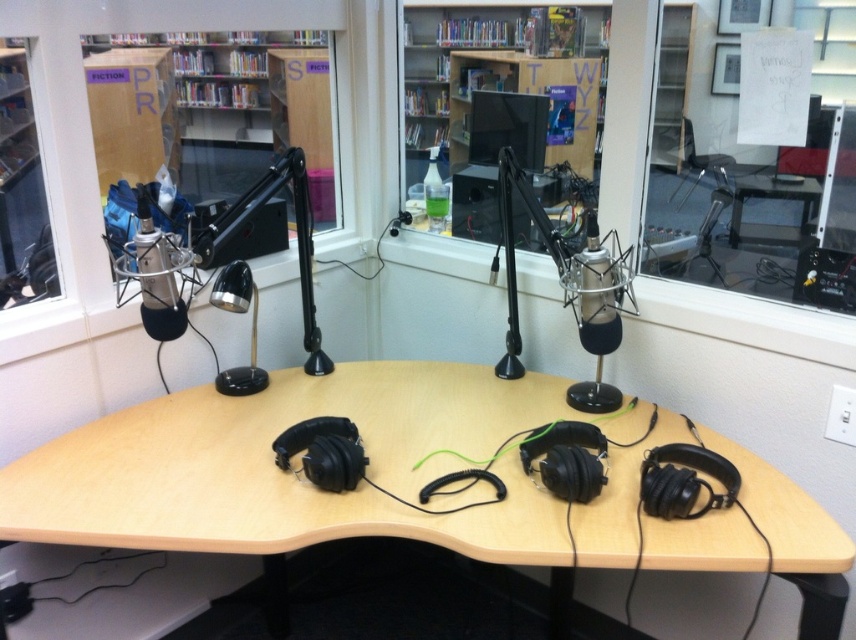
Question: Which of the following is the farthest from the observer?

Choices:
 (A) (158, 296)
 (B) (415, 138)
 (C) (809, 205)
 (D) (269, 196)

Answer: (B)

Question: Which object appears farthest from the camera in this image?

Choices:
 (A) wooden bookshelf at center
 (B) wooden at center
 (C) black metallic desk lamp at left
 (D) matte black microphone at upper left

Answer: (A)

Question: Can you confirm if wooden table at center is positioned above matte black microphone at upper left?

Choices:
 (A) no
 (B) yes

Answer: (B)

Question: Does wooden at center have a greater width compared to silver metallic microphone at left?

Choices:
 (A) no
 (B) yes

Answer: (B)

Question: Which object is the closest to the brown cardboard bookshelf at upper center?

Choices:
 (A) wooden table at center
 (B) matte black microphone at upper left

Answer: (B)

Question: Is brown cardboard bookshelf at upper center in front of black metallic desk lamp at left?

Choices:
 (A) yes
 (B) no

Answer: (A)